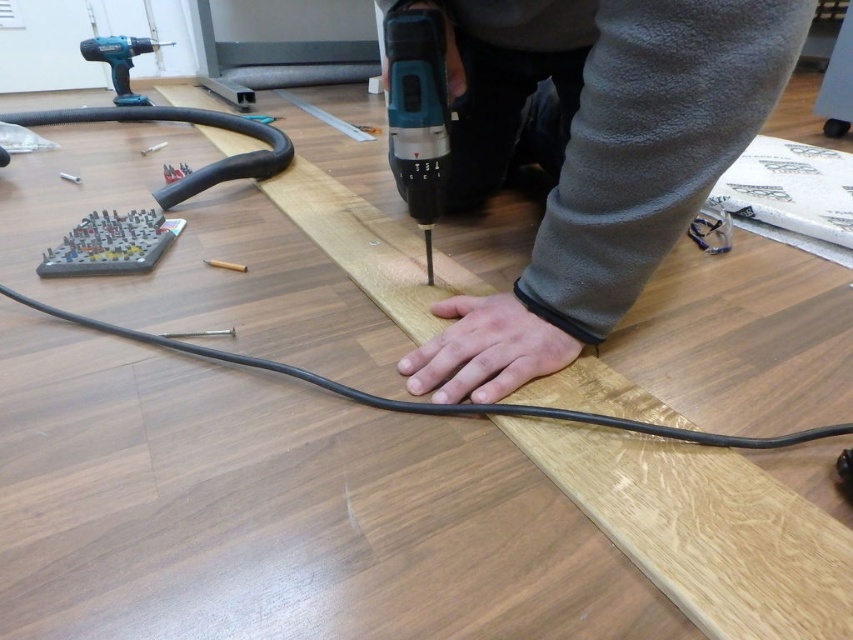
You are a robot trying to determine if you can fit through the space between the gray fleece pants at center and the blue plastic drill at upper left. Your width is 0.5 meters. Can you pass through?

The gray fleece pants at center might be wider than blue plastic drill at upper left, but without exact measurements, it is uncertain if the space between them is sufficient for the robot to pass through.

You are a delivery robot that is 10 inches wide. You need to deliver a package to the gray fleece pants at center. Is there enough space between you and the pants to move through?

The gray fleece pants at center is 20.67 inches away from viewer. Since the robot is 10 inches wide, there is sufficient space as the distance is greater than the robot width.

You are standing in the workshop and see the blue plastic drill at center and the blue plastic drill at upper left. Which one is located lower in the image?

The blue plastic drill at center is located lower in the image because it is below the blue plastic drill at upper left.